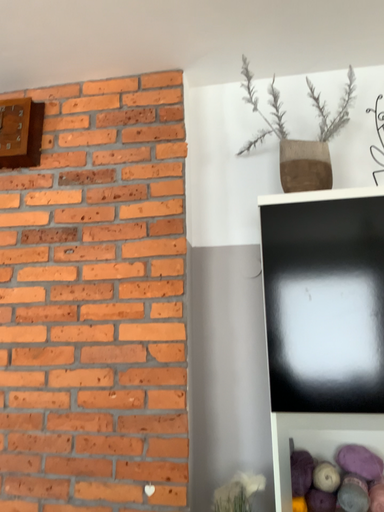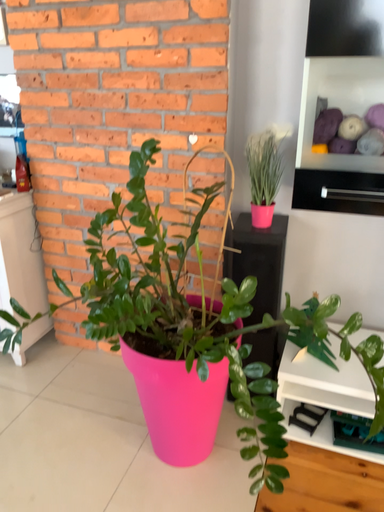
Question: How did the camera likely rotate when shooting the video?

Choices:
 (A) rotated downward
 (B) rotated upward

Answer: (A)